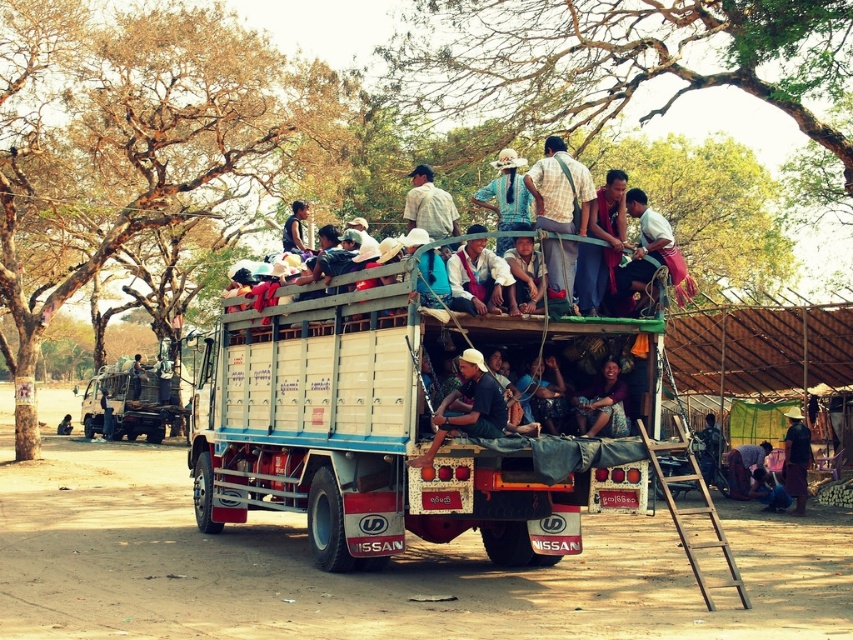
Does white fabric shirt at upper right appear over blue fabric shirt at center?

No.

Between white fabric shirt at upper right and blue fabric shirt at center, which one appears on the right side from the viewer's perspective?

white fabric shirt at upper right

What do you see at coordinates (648, 250) in the screenshot? Image resolution: width=853 pixels, height=640 pixels. I see `white fabric shirt at upper right` at bounding box center [648, 250].

At what (x,y) coordinates should I click in order to perform the action: click on white fabric shirt at upper right. Please return your answer as a coordinate pair (x, y). This screenshot has width=853, height=640. Looking at the image, I should click on (x=648, y=250).

Does checkered fabric shirt at center have a lesser height compared to dark blue shirt at center?

Yes.

Is point (558, 138) less distant than point (288, 232)?

That is True.

Which is behind, point (575, 257) or point (286, 220)?

Point (286, 220)

Where is `checkered fabric shirt at center`? Image resolution: width=853 pixels, height=640 pixels. checkered fabric shirt at center is located at coordinates (560, 189).

Between matte blue shirt at center and brown fabric shirt at center, which one appears on the right side from the viewer's perspective?

matte blue shirt at center is more to the right.

Between point (616, 195) and point (517, 256), which one is positioned in front?

Point (517, 256) is in front.

At what (x,y) coordinates should I click in order to perform the action: click on matte blue shirt at center. Please return your answer as a coordinate pair (x, y). This screenshot has width=853, height=640. Looking at the image, I should click on (601, 244).